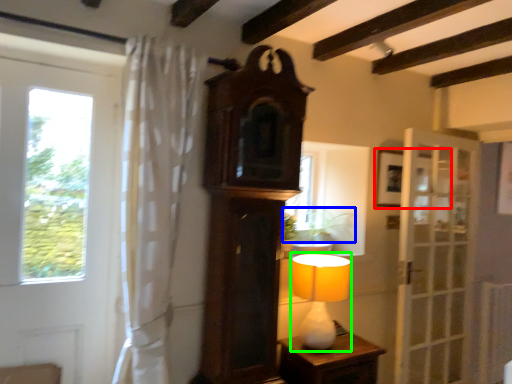
Question: Which object is positioned farthest from picture frame (highlighted by a red box)? Select from plant (highlighted by a blue box) and table lamp (highlighted by a green box).

Choices:
 (A) plant
 (B) table lamp

Answer: (B)